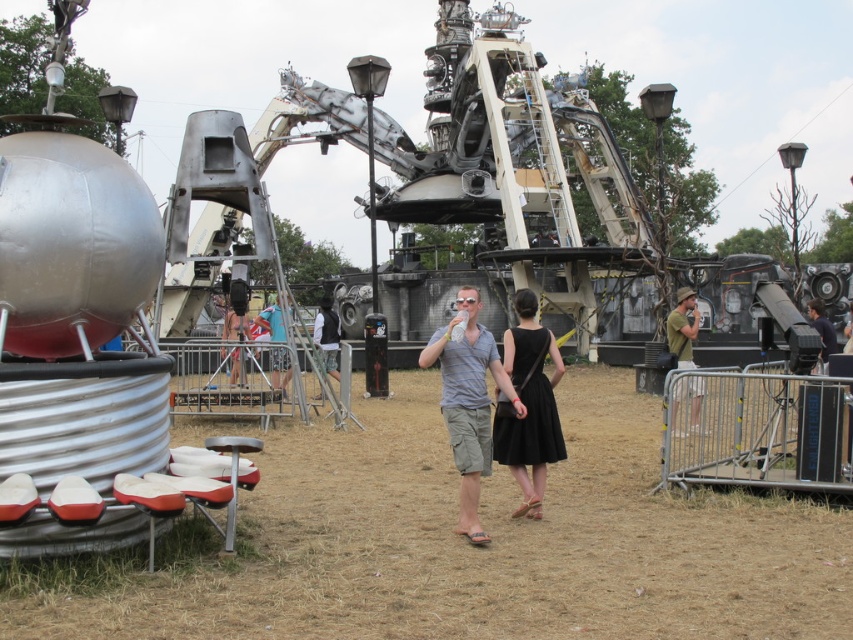
Question: Which is farther from the brown dry grass at center?

Choices:
 (A) matte gray shirt at center
 (B) dark blue shirt at center

Answer: (B)

Question: Does brown dry grass at center appear on the left side of matte gray shirt at center?

Choices:
 (A) yes
 (B) no

Answer: (A)

Question: Which object is the closest to the white shirt at center?

Choices:
 (A) brown dry grass at center
 (B) matte gray shirt at center
 (C) dark blue shirt at center

Answer: (A)

Question: Considering the real-world distances, which object is farthest from the brown dry grass at center?

Choices:
 (A) green matte shirt at right
 (B) white shirt at center
 (C) dark blue shirt at center
 (D) black satin dress at center

Answer: (B)

Question: Does brown dry grass at center appear on the left side of dark blue shirt at center?

Choices:
 (A) no
 (B) yes

Answer: (B)

Question: Does brown dry grass at center appear on the right side of dark blue shirt at center?

Choices:
 (A) no
 (B) yes

Answer: (A)